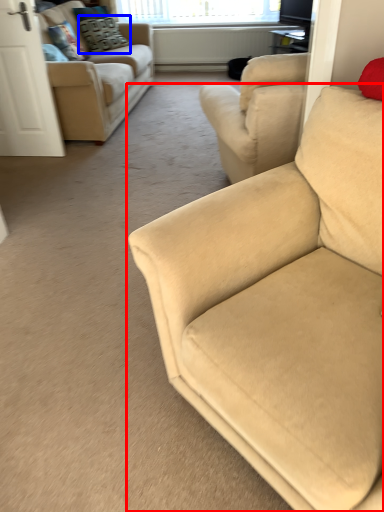
Question: Among these objects, which one is farthest to the camera, studio couch (highlighted by a red box) or pillow (highlighted by a blue box)?

Choices:
 (A) studio couch
 (B) pillow

Answer: (B)